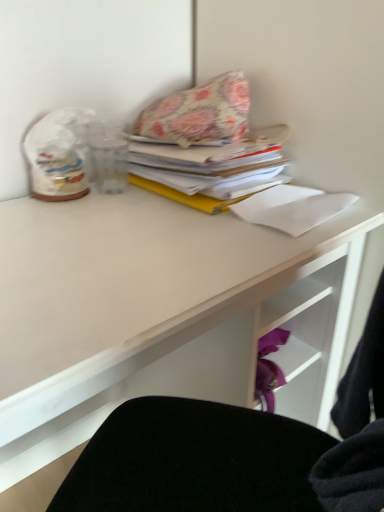
Question: In terms of size, does white matte desk at upper center appear bigger or smaller than floral fabric pillow at upper center?

Choices:
 (A) small
 (B) big

Answer: (B)

Question: Is white matte desk at upper center to the left or to the right of floral fabric pillow at upper center in the image?

Choices:
 (A) right
 (B) left

Answer: (B)

Question: Which of these objects is positioned closest to the white paper at upper right?

Choices:
 (A) white matte desk at upper center
 (B) floral fabric pillow at upper center

Answer: (B)

Question: Estimate the real-world distances between objects in this image. Which object is farther from the floral fabric pillow at upper center?

Choices:
 (A) white paper at upper right
 (B) white matte desk at upper center

Answer: (B)